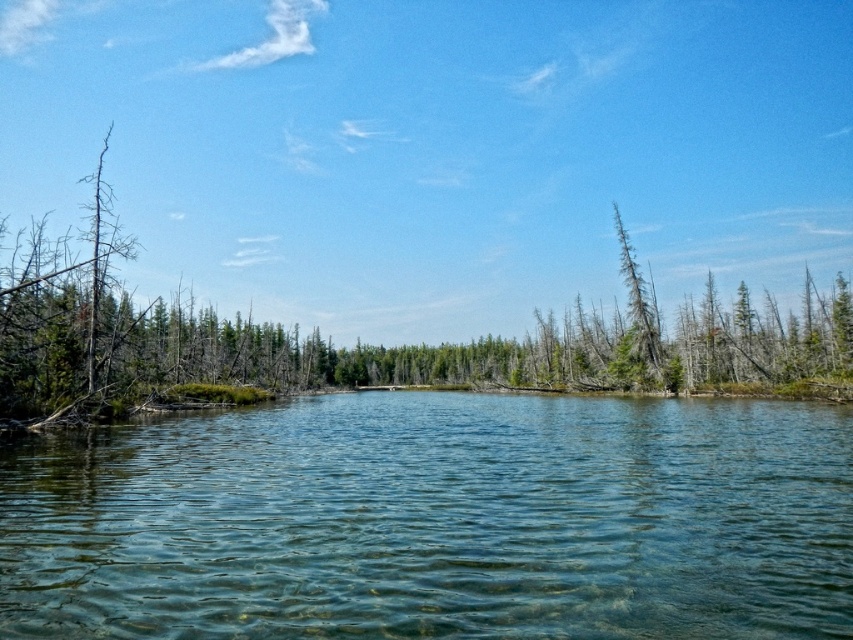
You are standing at the edge of the scene and want to walk from the green matte tree at center to the clear water at center. Which direction should you move relative to the tree?

To move from the green matte tree at center to the clear water at center, you should move to the right since the clear water at center is positioned on the right side of the green matte tree at center.